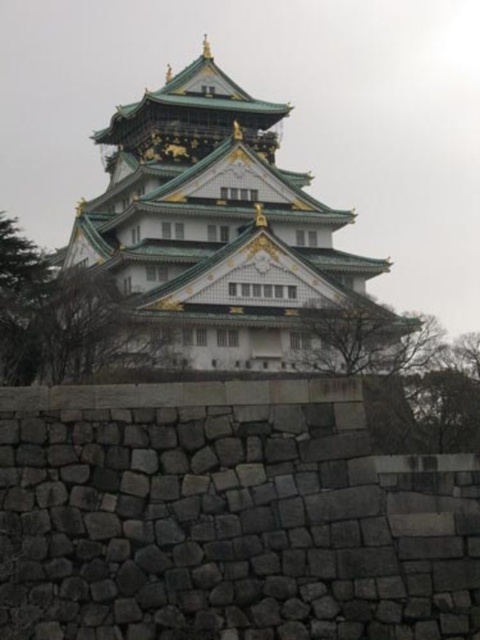
Does gray stone wall at lower center have a larger size compared to green glazed tile tower at center?

Actually, gray stone wall at lower center might be smaller than green glazed tile tower at center.

Between gray stone wall at lower center and green glazed tile tower at center, which one has less height?

gray stone wall at lower center

Is point (171, 522) positioned in front of point (300, 332)?

Yes, it is in front of point (300, 332).

You are a GUI agent. You are given a task and a screenshot of the screen. Output one action in this format:
    pyautogui.click(x=<x>, y=<y>)
    Task: Click on the gray stone wall at lower center
    
    Given the screenshot: What is the action you would take?
    227,516